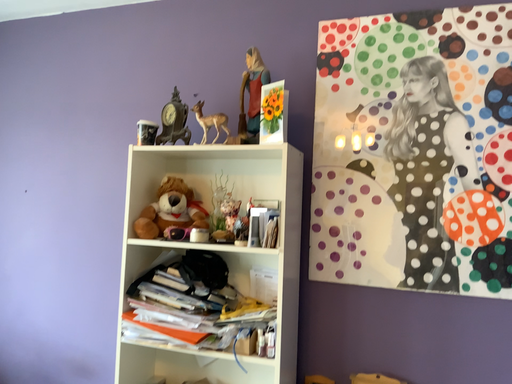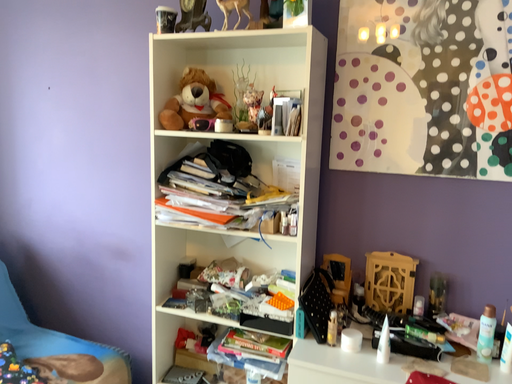
Question: Which way did the camera rotate in the video?

Choices:
 (A) rotated upward
 (B) rotated downward

Answer: (B)